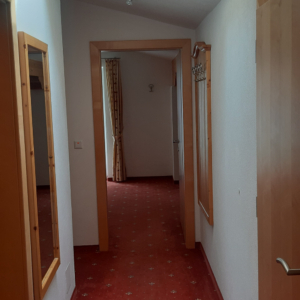
Find the location of a particular element. curtains is located at coordinates (121, 152), (118, 123).